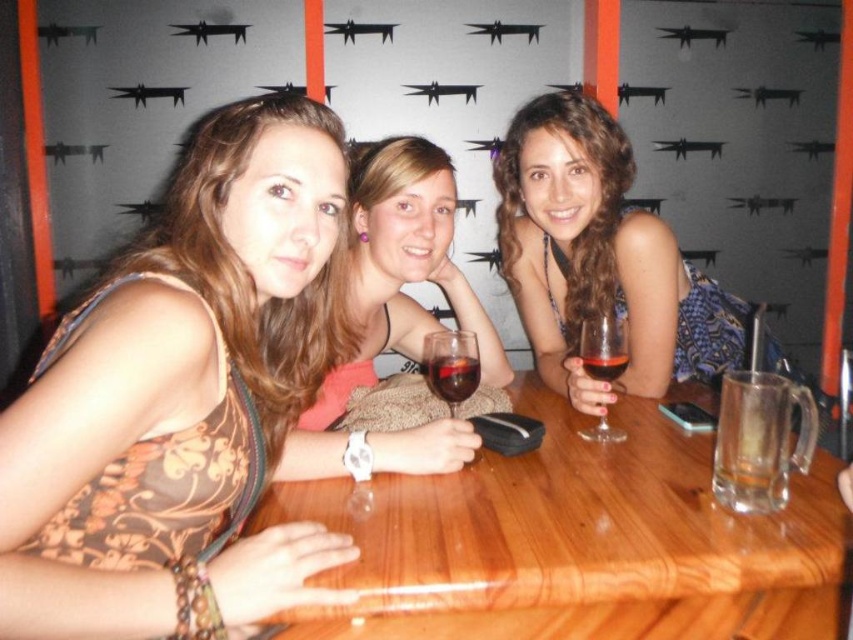
You are a photographer setting up a shoot at this location. You need to position a spotlight so that it illuminates the wooden table at center without casting a shadow on the matte black dress at center. Is this possible given their spatial arrangement?

The wooden table at center is in front of the matte black dress at center, so positioning the spotlight behind the dress would allow light to hit the table while avoiding casting a shadow on the dress.

You are a photographer setting up a shoot at the wooden table at center and the matte black dress at center. To ensure proper lighting, you need to know the spatial relationship between them. Which object is located to the left of the other?

The wooden table at center is positioned on the left side of matte black dress at center, so the wooden table at center is to the left of the matte black dress at center.